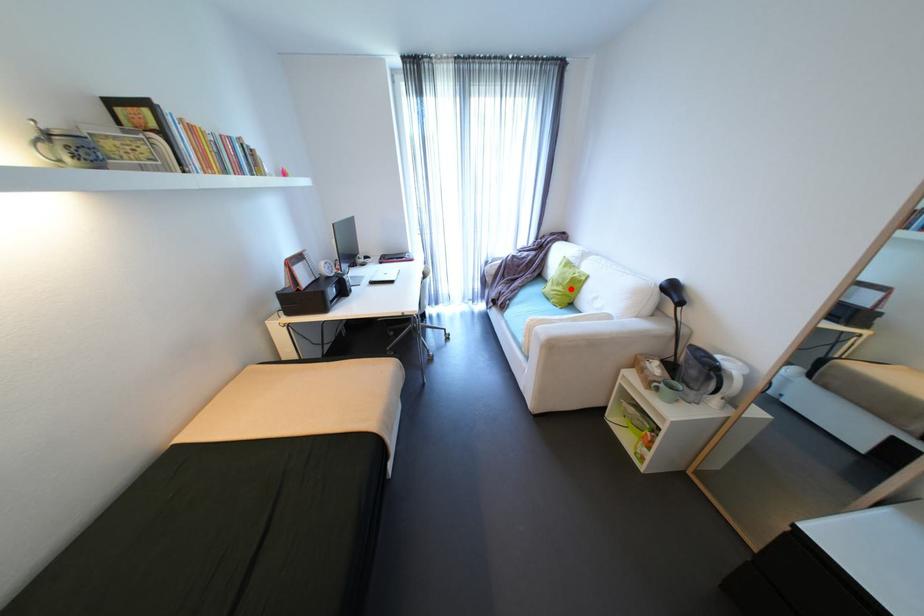
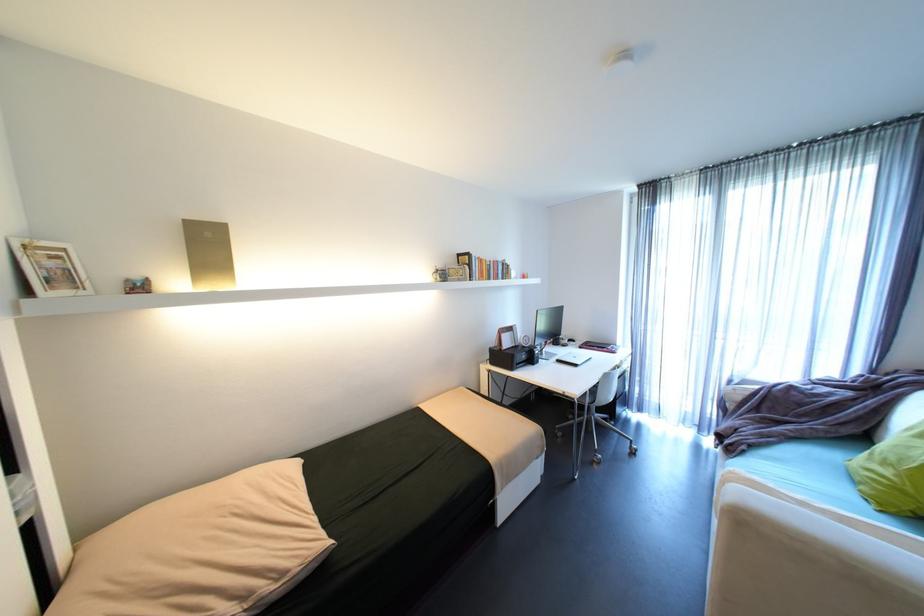
Find the pixel in the second image that matches the highlighted location in the first image.

(906, 476)